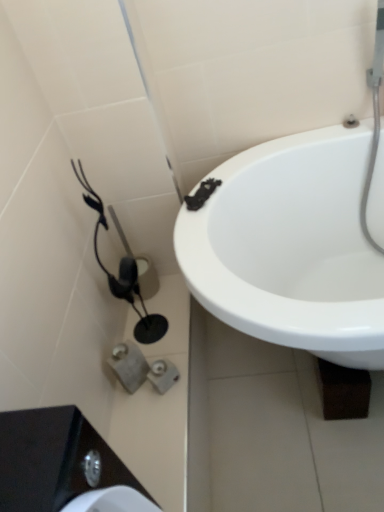
What is the approximate height of white glossy bathtub at right?

white glossy bathtub at right is 24.37 inches tall.

Locate an element on the screen. This screenshot has height=512, width=384. white glossy bathtub at right is located at coordinates (291, 247).

Describe the element at coordinates (291, 247) in the screenshot. I see `white glossy bathtub at right` at that location.

Where is `white glossy bathtub at right`? white glossy bathtub at right is located at coordinates (291, 247).